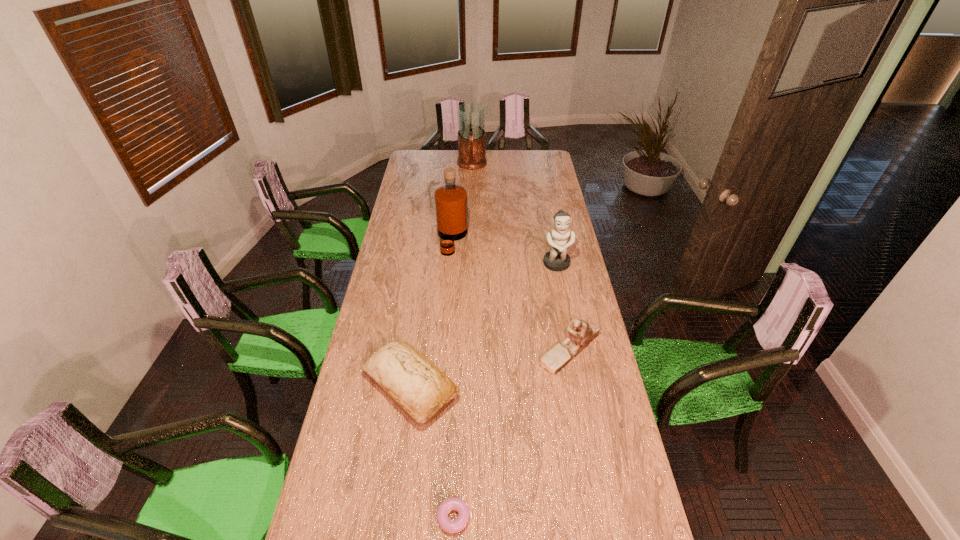
The height and width of the screenshot is (540, 960). In order to click on blank space located 0.070m on the front-facing side of the farther figurine in this screenshot , I will do `click(561, 285)`.

The width and height of the screenshot is (960, 540). Identify the location of free space located 0.100m on the front-facing side of the shorter figurine. point(511,349).

You are a GUI agent. You are given a task and a screenshot of the screen. Output one action in this format:
    pyautogui.click(x=<x>, y=<y>)
    Task: Click on the vacant space positioned on the front-facing side of the shorter figurine
    The height and width of the screenshot is (540, 960).
    Given the screenshot: What is the action you would take?
    pyautogui.click(x=444, y=349)

Where is `vacant space located 0.100m on the front-facing side of the shorter figurine`? This screenshot has height=540, width=960. vacant space located 0.100m on the front-facing side of the shorter figurine is located at coordinates (511, 349).

I want to click on vacant space located 0.330m on the back of the second shortest object, so (x=424, y=289).

Locate an element on the screen. The image size is (960, 540). vacant space situated 0.150m on the left of the shortest object is located at coordinates (375, 517).

This screenshot has width=960, height=540. What are the coordinates of `object that is positioned at the far edge` in the screenshot? It's located at (471, 116).

You are a GUI agent. You are given a task and a screenshot of the screen. Output one action in this format:
    pyautogui.click(x=<x>, y=<y>)
    Task: Click on the object at the left edge
    
    Given the screenshot: What is the action you would take?
    pyautogui.click(x=412, y=381)

The width and height of the screenshot is (960, 540). Find the location of `vacant area at the left edge of the desktop`. vacant area at the left edge of the desktop is located at coordinates (346, 516).

This screenshot has height=540, width=960. In the image, there is a desktop. What are the coordinates of `vacant region at the right edge` in the screenshot? It's located at (601, 509).